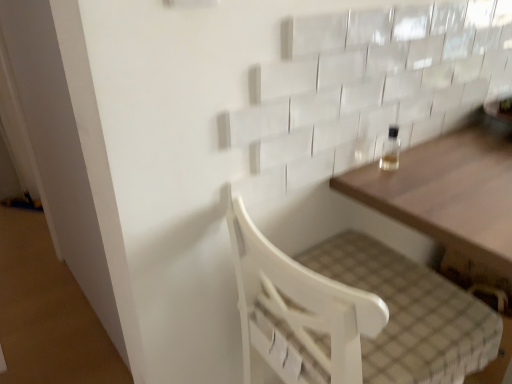
Question: Based on their positions, is wooden table at upper right located to the left or right of white wood chair at lower center?

Choices:
 (A) left
 (B) right

Answer: (B)

Question: Considering the positions of wooden table at upper right and white wood chair at lower center in the image, is wooden table at upper right bigger or smaller than white wood chair at lower center?

Choices:
 (A) small
 (B) big

Answer: (B)

Question: Which of these objects is positioned farthest from the clear glass bottle at upper right?

Choices:
 (A) white wood chair at lower center
 (B) wooden table at upper right

Answer: (A)

Question: Based on their relative distances, which object is nearer to the clear glass bottle at upper right?

Choices:
 (A) wooden table at upper right
 (B) white wood chair at lower center

Answer: (A)